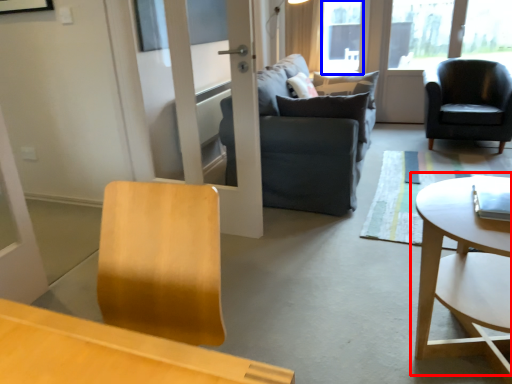
Question: Which of the following is the closest to the observer, coffee table (highlighted by a red box) or window screen (highlighted by a blue box)?

Choices:
 (A) coffee table
 (B) window screen

Answer: (A)